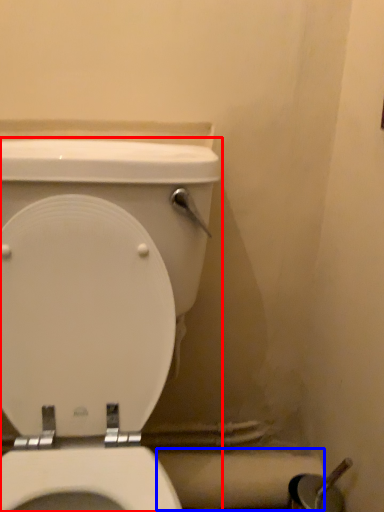
Question: Which of the following is the farthest to the observer, toilet (highlighted by a red box) or toilet paper (highlighted by a blue box)?

Choices:
 (A) toilet
 (B) toilet paper

Answer: (B)